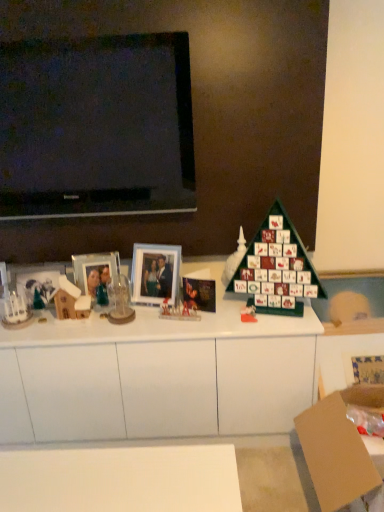
This screenshot has width=384, height=512. I want to click on free space in front of wooden house at left, acting as the first toy starting from the left, so click(x=64, y=335).